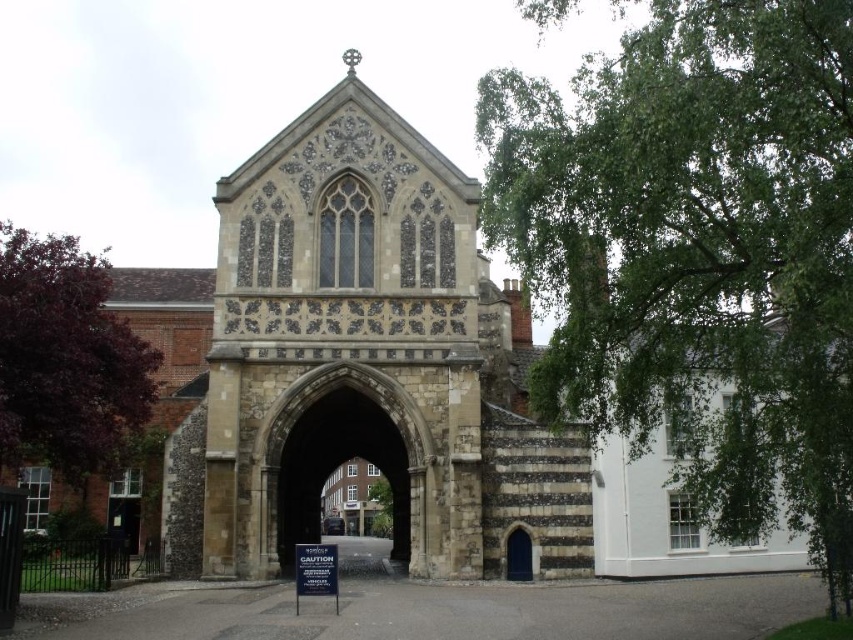
Between point (7, 378) and point (381, 509), which one is positioned behind?

Positioned behind is point (381, 509).

Which of these two, purple leafy tree at left or green leafy tree at center, stands shorter?

Standing shorter between the two is green leafy tree at center.

The height and width of the screenshot is (640, 853). What do you see at coordinates (65, 358) in the screenshot?
I see `purple leafy tree at left` at bounding box center [65, 358].

You are a GUI agent. You are given a task and a screenshot of the screen. Output one action in this format:
    pyautogui.click(x=<x>, y=<y>)
    Task: Click on the purple leafy tree at left
    This screenshot has width=853, height=640.
    Given the screenshot: What is the action you would take?
    pyautogui.click(x=65, y=358)

Is stone archway at center wider than blue stone archway at center?

Yes, stone archway at center is wider than blue stone archway at center.

Is stone archway at center above blue stone archway at center?

Indeed, stone archway at center is positioned over blue stone archway at center.

This screenshot has height=640, width=853. What are the coordinates of `stone archway at center` in the screenshot? It's located at (340, 458).

Does blue stone archway at center have a greater width compared to green leafy tree at center?

No.

Who is more distant from viewer, (515, 532) or (379, 500)?

The point (379, 500) is more distant.

The height and width of the screenshot is (640, 853). I want to click on blue stone archway at center, so tap(518, 556).